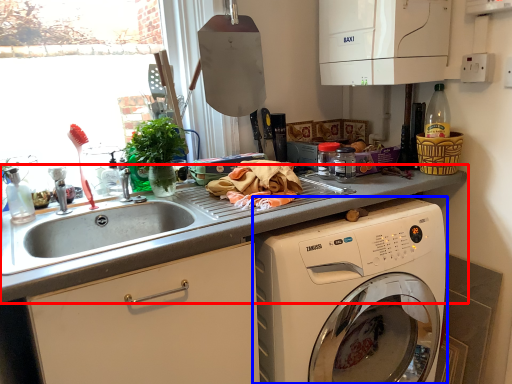
Question: Which of the following is the closest to the observer, countertop (highlighted by a red box) or washing machine (highlighted by a blue box)?

Choices:
 (A) countertop
 (B) washing machine

Answer: (A)